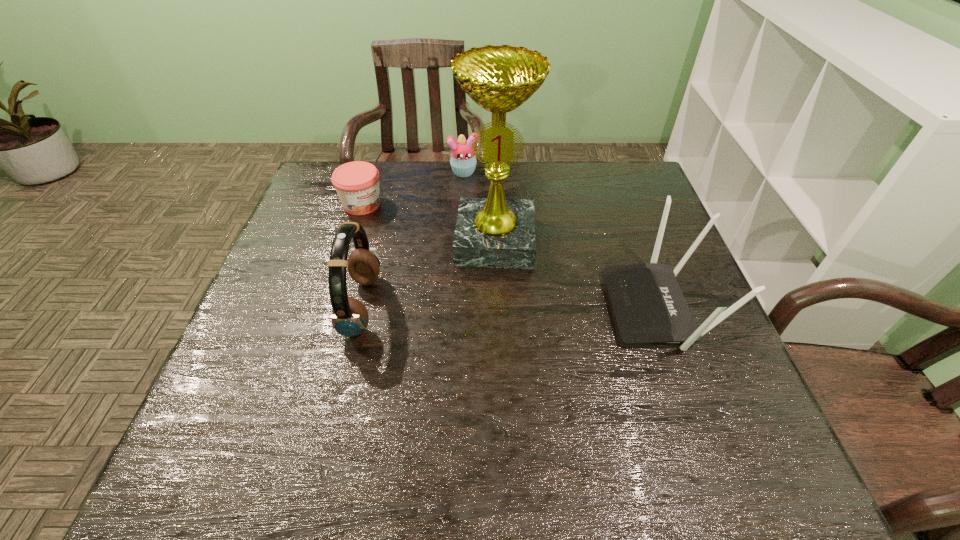
Identify the location of vacant position at the far left corner of the desktop. click(x=359, y=160).

I want to click on empty space between the award and the headset, so click(428, 274).

Locate an element on the screen. Image resolution: width=960 pixels, height=540 pixels. free space that is in between the tallest object and the jam is located at coordinates (428, 222).

This screenshot has height=540, width=960. Find the location of `free space that is in between the cupcake and the shortest object`. free space that is in between the cupcake and the shortest object is located at coordinates (413, 188).

Image resolution: width=960 pixels, height=540 pixels. I want to click on free space between the cupcake and the shortest object, so pos(413,188).

Find the location of a particular element. Image resolution: width=960 pixels, height=540 pixels. vacant space that is in between the jam and the cupcake is located at coordinates (413, 188).

This screenshot has height=540, width=960. I want to click on vacant area between the rightmost object and the second shortest object, so click(561, 240).

This screenshot has width=960, height=540. Identify the location of object that ranks as the closest to the cupcake. (357, 183).

Select which object appears as the second closest to the rightmost object. Please provide its 2D coordinates. Your answer should be formatted as a tuple, i.e. [(x, y)], where the tuple contains the x and y coordinates of a point satisfying the conditions above.

[(463, 162)]

The image size is (960, 540). Identify the location of free space that satisfies the following two spatial constraints: 1. on the front side of the cupcake; 2. on the right side of the award. (461, 241).